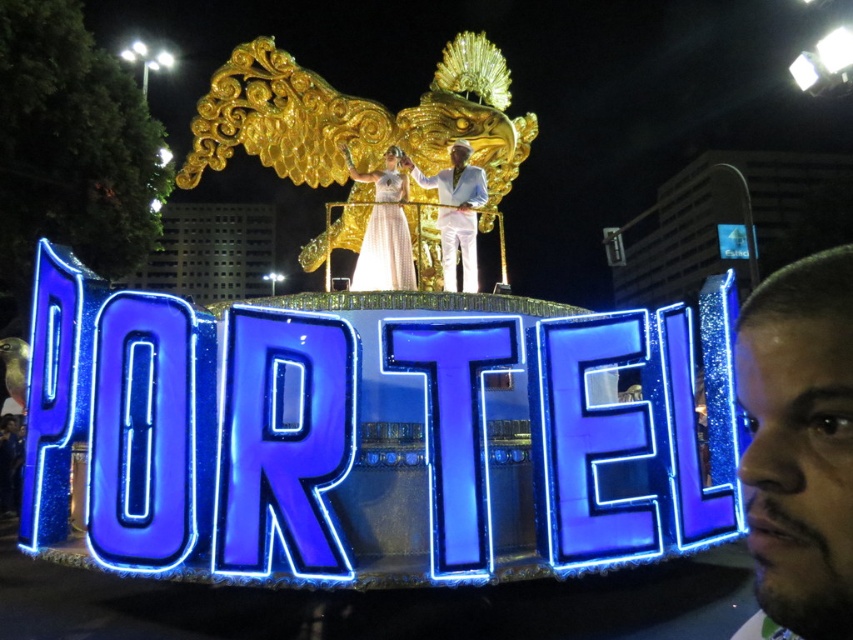
Between point (769, 515) and point (381, 269), which one is positioned behind?

The point (381, 269) is behind.

Which is behind, point (770, 422) or point (364, 180)?

The point (364, 180) is more distant.

The image size is (853, 640). Find the location of `dark brown hair at lower right`. dark brown hair at lower right is located at coordinates pyautogui.click(x=799, y=442).

Who is more forward, (x=405, y=193) or (x=444, y=205)?

Positioned in front is point (x=444, y=205).

Between pearl-like fabric dress at center and white satin suit at center, which one is positioned higher?

pearl-like fabric dress at center is higher up.

The width and height of the screenshot is (853, 640). What do you see at coordinates (384, 228) in the screenshot?
I see `pearl-like fabric dress at center` at bounding box center [384, 228].

Where is `pearl-like fabric dress at center`? pearl-like fabric dress at center is located at coordinates click(x=384, y=228).

In the scene shown: Does dark brown hair at lower right have a lesser width compared to white satin suit at center?

Incorrect, dark brown hair at lower right's width is not less than white satin suit at center's.

Can you confirm if dark brown hair at lower right is positioned to the right of white satin suit at center?

Yes, dark brown hair at lower right is to the right of white satin suit at center.

Is point (747, 508) closer to viewer compared to point (469, 272)?

Yes, point (747, 508) is closer to viewer.

Find the location of `dark brown hair at lower right`. dark brown hair at lower right is located at coordinates (799, 442).